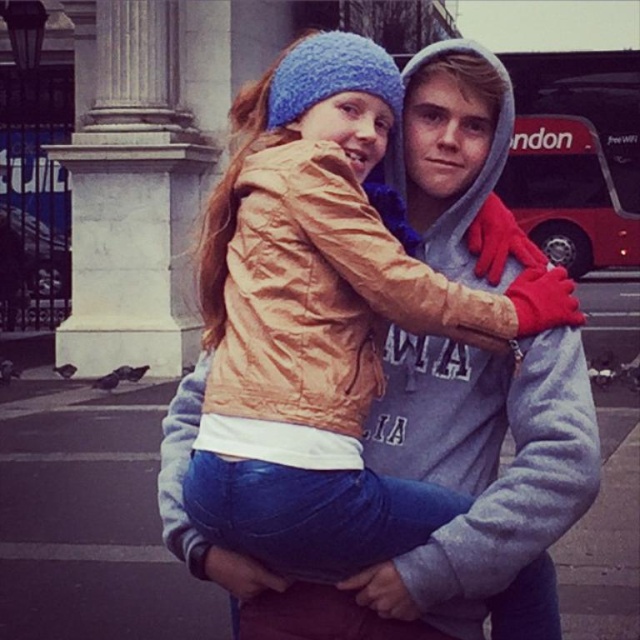
Question: Is white marble pillar at upper left below matte orange jacket at center?

Choices:
 (A) yes
 (B) no

Answer: (B)

Question: Which of the following is the closest to the observer?

Choices:
 (A) white marble pillar at upper left
 (B) matte orange jacket at center

Answer: (B)

Question: Does white marble pillar at upper left appear on the right side of matte orange jacket at center?

Choices:
 (A) yes
 (B) no

Answer: (B)

Question: Where is white marble pillar at upper left located in relation to matte orange jacket at center in the image?

Choices:
 (A) below
 (B) above

Answer: (B)